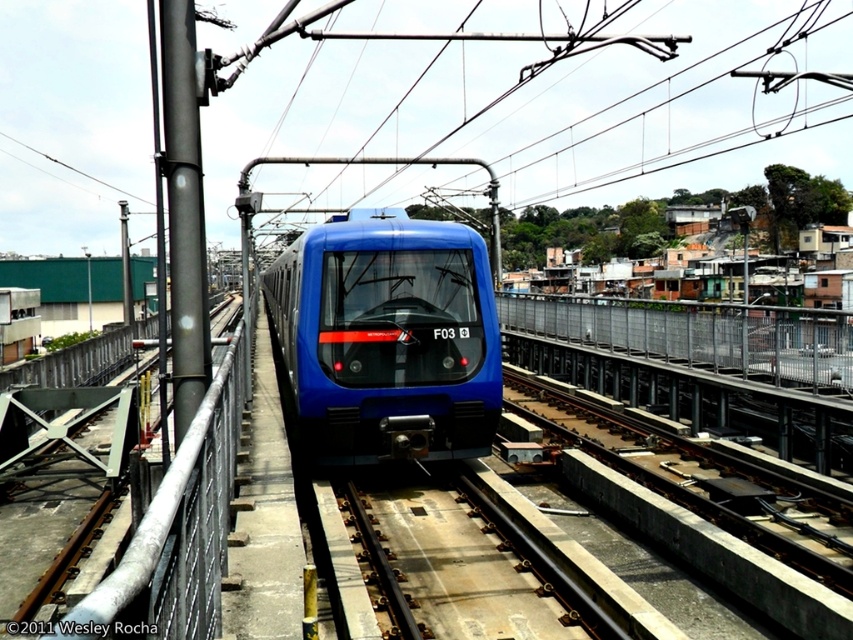
Is blue glossy train at center bigger than brown metallic train track at center?

Yes.

Identify the location of blue glossy train at center. The image size is (853, 640). (387, 337).

Where is `blue glossy train at center`? This screenshot has width=853, height=640. blue glossy train at center is located at coordinates click(387, 337).